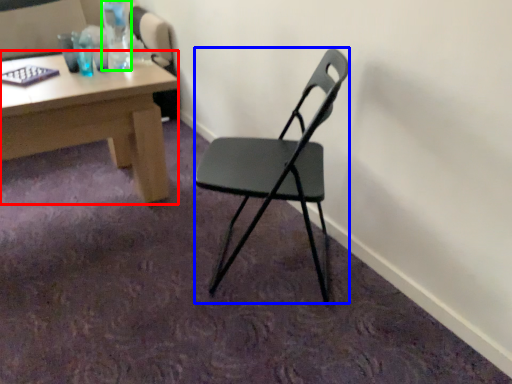
Question: Which object is positioned closest to desk (highlighted by a red box)? Select from chair (highlighted by a blue box) and bottle (highlighted by a green box).

Choices:
 (A) chair
 (B) bottle

Answer: (B)